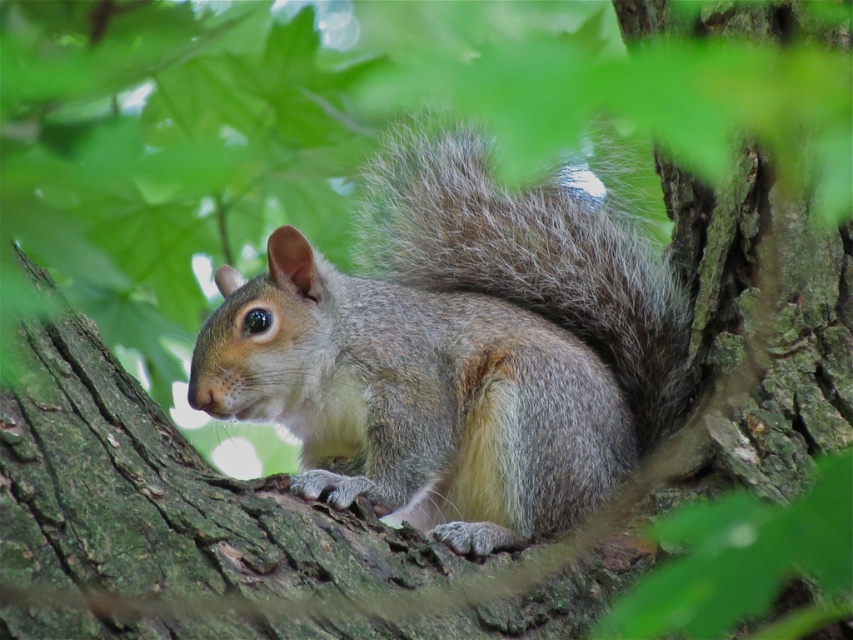
Which is more to the left, gray fur squirrel at center or brown rough tree trunk at center?

brown rough tree trunk at center is more to the left.

I want to click on gray fur squirrel at center, so click(x=456, y=352).